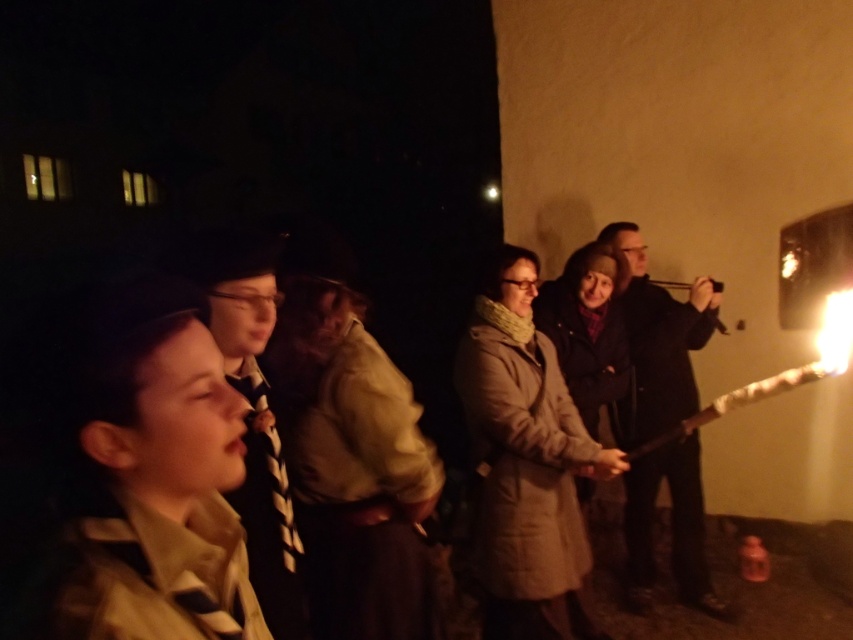
Who is higher up, light brown leather jacket at center or dark brown leather jacket at center?

light brown leather jacket at center is above.

The height and width of the screenshot is (640, 853). What do you see at coordinates (352, 467) in the screenshot? I see `light brown leather jacket at center` at bounding box center [352, 467].

Find the location of `light brown leather jacket at center`. light brown leather jacket at center is located at coordinates (352, 467).

Who is taller, dark brown leather jacket at center or striped tie at center?

dark brown leather jacket at center is taller.

Can you confirm if dark brown leather jacket at center is positioned to the left of striped tie at center?

In fact, dark brown leather jacket at center is to the right of striped tie at center.

Locate an element on the screen. dark brown leather jacket at center is located at coordinates (657, 342).

Identify the location of dark brown leather jacket at center. (657, 342).

Which is below, tan fabric uniform at left or striped tie at center?

Positioned lower is striped tie at center.

Does point (82, 408) come in front of point (215, 340)?

Yes, point (82, 408) is in front of point (215, 340).

Does point (260, 616) lie in front of point (209, 285)?

Yes, it is.

This screenshot has width=853, height=640. I want to click on tan fabric uniform at left, so click(154, 474).